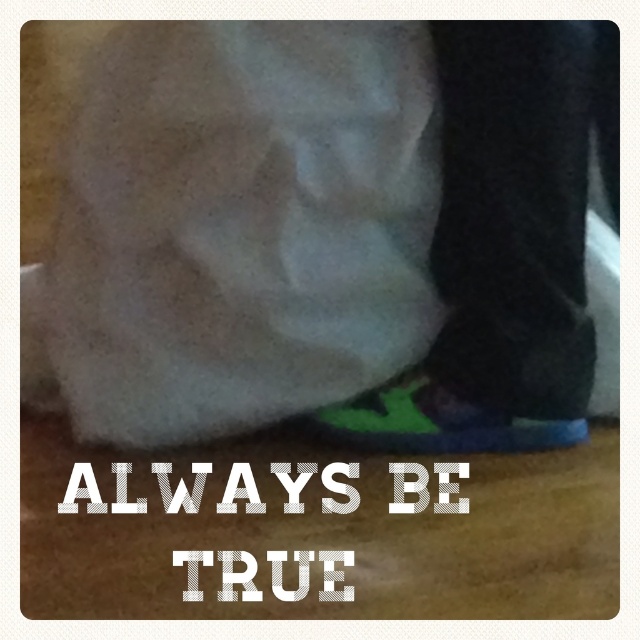
Question: Which point is farther to the camera?

Choices:
 (A) green fabric shoe at lower right
 (B) green suede shoe at lower center

Answer: (B)

Question: Is green fabric shoe at lower right smaller than green suede shoe at lower center?

Choices:
 (A) yes
 (B) no

Answer: (B)

Question: Which object is closer to the camera taking this photo?

Choices:
 (A) green fabric shoe at lower right
 (B) green suede shoe at lower center

Answer: (A)

Question: Among these objects, which one is nearest to the camera?

Choices:
 (A) green fabric shoe at lower right
 (B) green suede shoe at lower center

Answer: (A)

Question: Is green fabric shoe at lower right positioned before green suede shoe at lower center?

Choices:
 (A) no
 (B) yes

Answer: (B)

Question: Does green fabric shoe at lower right lie behind green suede shoe at lower center?

Choices:
 (A) no
 (B) yes

Answer: (A)